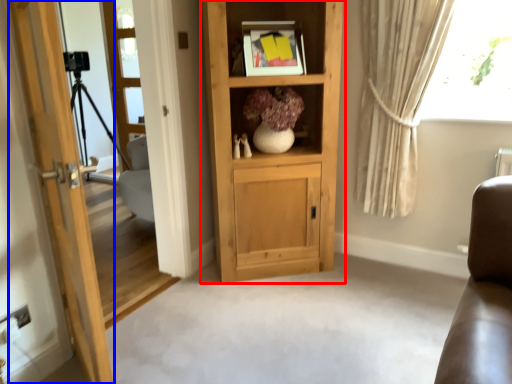
Question: Among these objects, which one is farthest to the camera, cabinetry (highlighted by a red box) or door (highlighted by a blue box)?

Choices:
 (A) cabinetry
 (B) door

Answer: (A)